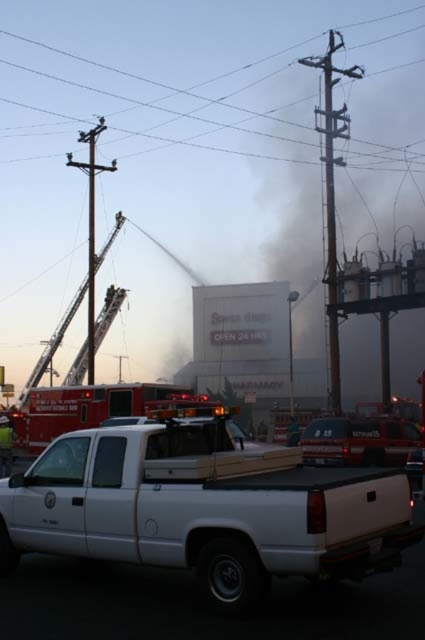
Can you confirm if brown wooden pole at upper center is smaller than red uniform fireman at center?

Actually, brown wooden pole at upper center might be larger than red uniform fireman at center.

Which of these two, brown wooden pole at upper center or red uniform fireman at center, stands taller?

brown wooden pole at upper center is taller.

I want to click on brown wooden pole at upper center, so click(x=153, y=81).

Find the location of a particular element. This screenshot has height=640, width=425. brown wooden pole at upper center is located at coordinates (153, 81).

Is point (2, 529) behind point (255, 131)?

No.

Is white matte truck bed at lower center shorter than brown wooden pole at upper center?

Indeed, white matte truck bed at lower center has a lesser height compared to brown wooden pole at upper center.

Which is in front, point (269, 483) or point (8, 60)?

Positioned in front is point (269, 483).

I want to click on white matte truck bed at lower center, so click(204, 508).

Is the position of white matte truck bed at lower center more distant than that of red uniform fireman at center?

No, it is in front of red uniform fireman at center.

Who is higher up, white matte truck bed at lower center or red uniform fireman at center?

white matte truck bed at lower center is above.

Which is behind, point (150, 536) or point (0, 445)?

The point (0, 445) is behind.

Locate an element on the screen. white matte truck bed at lower center is located at coordinates (204, 508).